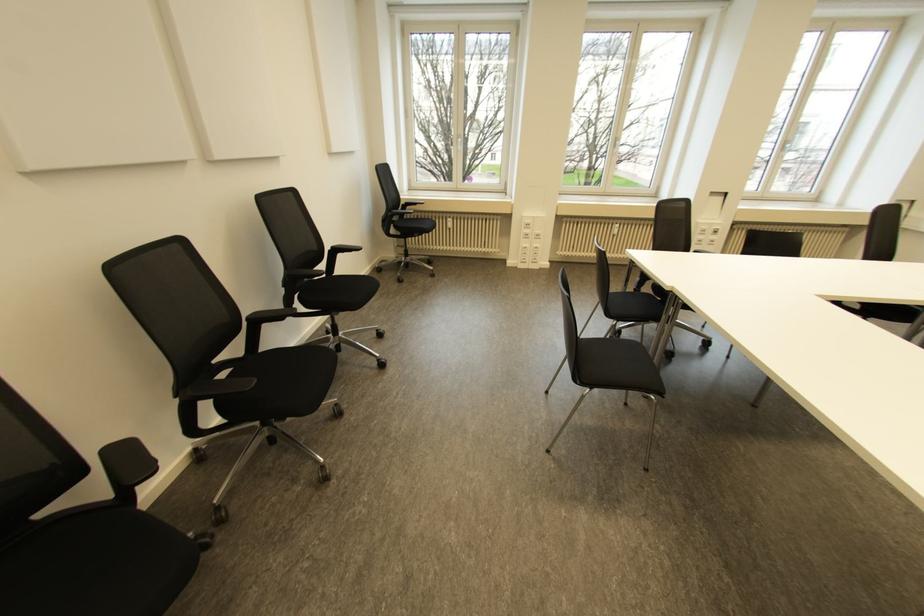
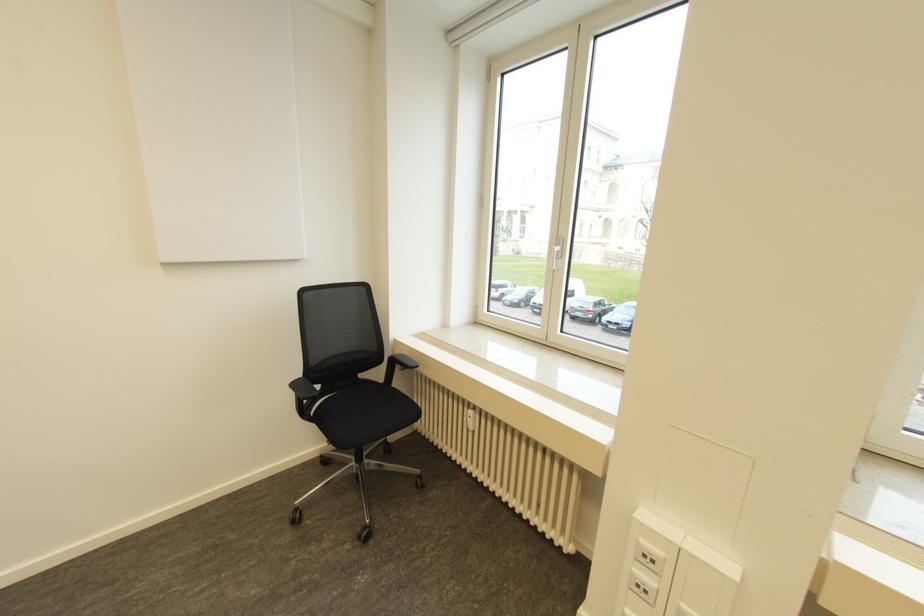
Find the pixel in the second image that matches point (448, 219) in the first image.

(469, 411)